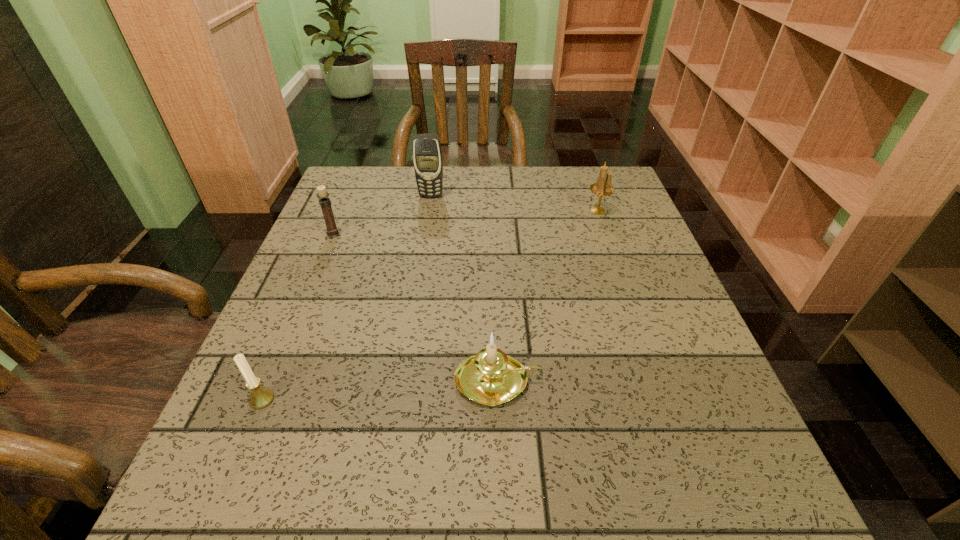
In the image, there is a desktop. Where is `free space at the far right corner`? This screenshot has width=960, height=540. free space at the far right corner is located at coordinates (622, 184).

The width and height of the screenshot is (960, 540). Identify the location of empty space that is in between the rightmost candle holder and the second object from right to left. (547, 296).

Where is `free space between the third object from right to left and the second farthest candle holder`? The width and height of the screenshot is (960, 540). free space between the third object from right to left and the second farthest candle holder is located at coordinates (382, 215).

This screenshot has width=960, height=540. I want to click on free point between the fourth object from left to right and the rightmost candle holder, so click(547, 296).

Where is `unoccupied area between the second farthest candle holder and the third object from left to right`? The height and width of the screenshot is (540, 960). unoccupied area between the second farthest candle holder and the third object from left to right is located at coordinates (382, 215).

Identify the location of vacant space that is in between the second candle holder from right to left and the fourth nearest object. This screenshot has width=960, height=540. (547, 296).

This screenshot has width=960, height=540. I want to click on unoccupied position between the third nearest candle holder and the rightmost object, so click(466, 222).

Locate an element on the screen. This screenshot has width=960, height=540. object identified as the fourth closest to the third farthest object is located at coordinates (603, 187).

Identify the location of object that stands as the fourth closest to the third object from left to right. This screenshot has width=960, height=540. (261, 397).

Identify which candle holder is the third closest to the farthest candle holder. Please provide its 2D coordinates. Your answer should be formatted as a tuple, i.e. [(x, y)], where the tuple contains the x and y coordinates of a point satisfying the conditions above.

[(261, 397)]